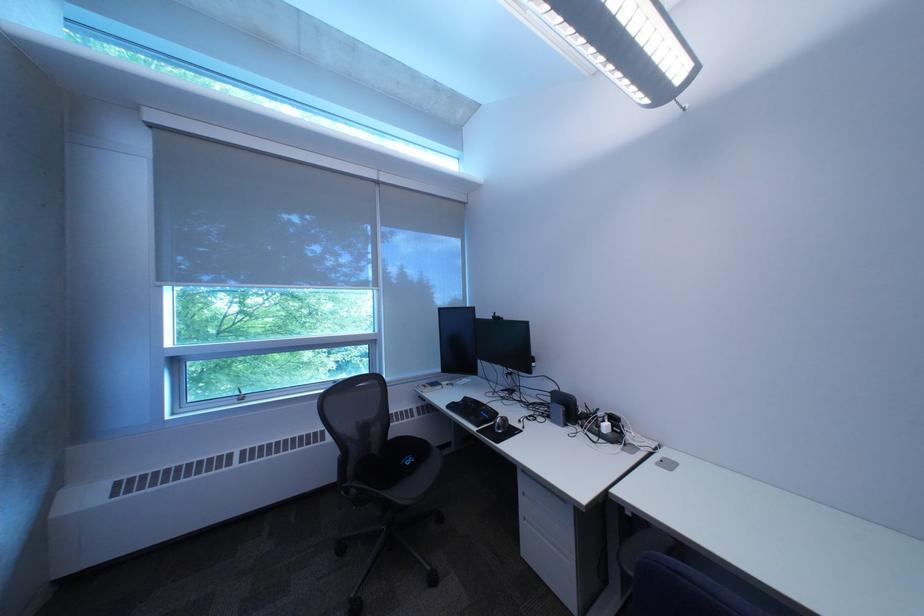
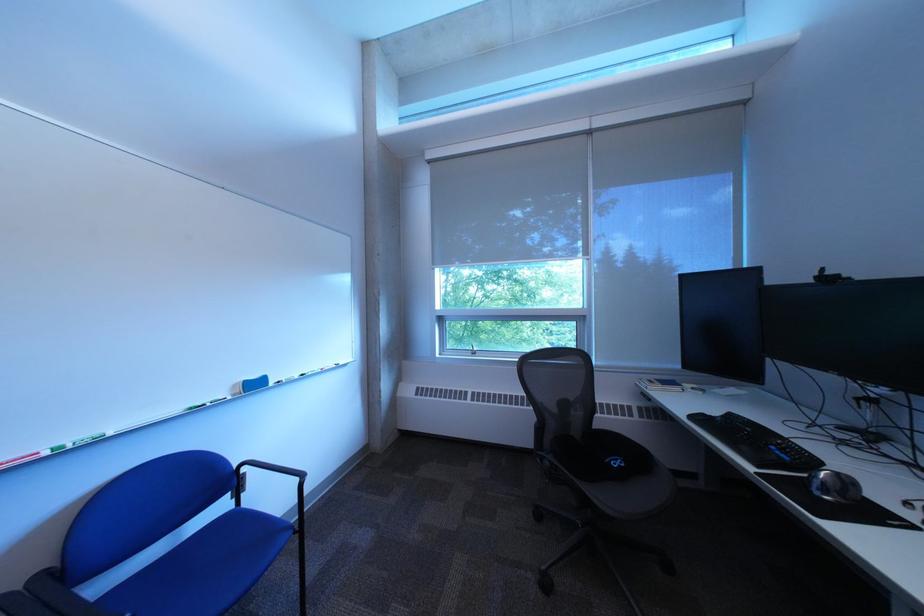
The point at (431, 392) is marked in the first image. Where is the corresponding point in the second image?

(651, 386)